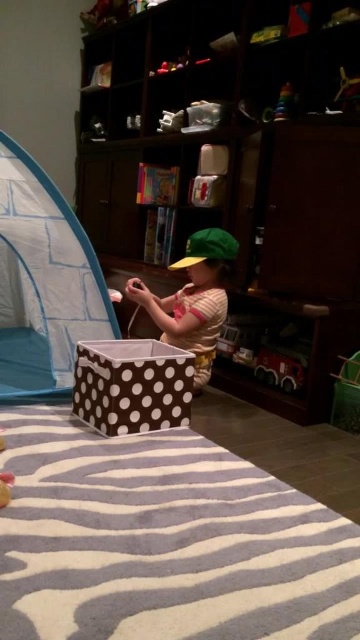
You are setting up a play area for a child. You have a blue fabric tent at center and a green fabric toddler at center. Which object should you place to the right to ensure the toddler can easily access the tent?

The blue fabric tent at center should be placed to the right of the green fabric toddler at center so the toddler can easily access it since the tent is currently on the left side of the toddler.

You are a parent trying to organize your child s toys. You have a storage box that can only hold items narrower than the shiny red plastic toy car at lower right. Can the shiny plastic toy at upper center fit into the storage box?

The shiny red plastic toy car at lower right might be wider than the shiny plastic toy at upper center. Since the storage box can only hold items narrower than the shiny red plastic toy car at lower right, the shiny plastic toy at upper center can fit into the storage box if it is narrower than the car.